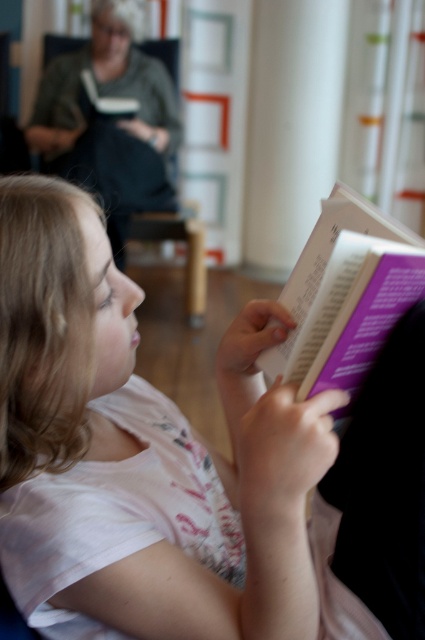
Question: Is white cotton shirt at center to the left of purple paper book at center from the viewer's perspective?

Choices:
 (A) yes
 (B) no

Answer: (A)

Question: Based on their relative distances, which object is farther from the purple paper book at center?

Choices:
 (A) green fabric sweater at upper left
 (B) white cotton shirt at center

Answer: (A)

Question: Which of the following is the closest to the observer?

Choices:
 (A) white cotton shirt at center
 (B) purple paper book at center

Answer: (B)

Question: Does white cotton shirt at center appear on the left side of green fabric sweater at upper left?

Choices:
 (A) yes
 (B) no

Answer: (B)

Question: Is purple paper book at center positioned before green fabric sweater at upper left?

Choices:
 (A) yes
 (B) no

Answer: (A)

Question: Which of the following is the closest to the observer?

Choices:
 (A) (5, 198)
 (B) (294, 360)

Answer: (B)